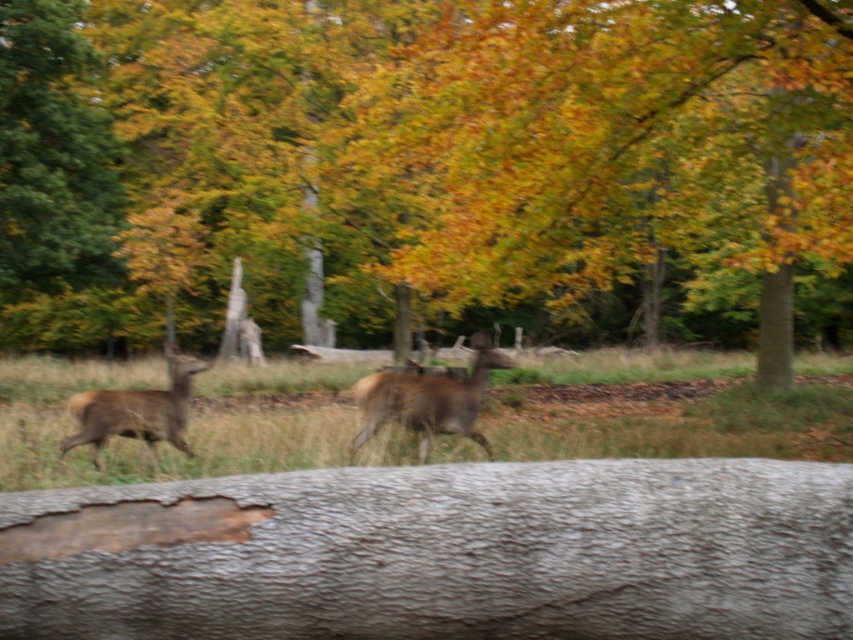
The height and width of the screenshot is (640, 853). What do you see at coordinates (427, 401) in the screenshot?
I see `brown matte/deer at center` at bounding box center [427, 401].

Does brown matte/deer at center appear on the right side of brown fur deer at left?

Indeed, brown matte/deer at center is positioned on the right side of brown fur deer at left.

Does point (392, 388) come behind point (169, 433)?

No, (392, 388) is in front of (169, 433).

At what (x,y) coordinates should I click in order to perform the action: click on brown matte/deer at center. Please return your answer as a coordinate pair (x, y). This screenshot has height=640, width=853. Looking at the image, I should click on (427, 401).

Does brown textured log at center have a larger size compared to smooth gray log at center?

Correct, brown textured log at center is larger in size than smooth gray log at center.

This screenshot has height=640, width=853. What do you see at coordinates (426, 172) in the screenshot? I see `brown textured log at center` at bounding box center [426, 172].

Is point (717, 77) behind point (538, 614)?

Yes.

Identify the location of brown textured log at center. The width and height of the screenshot is (853, 640). (426, 172).

This screenshot has height=640, width=853. In order to click on brown textured log at center in this screenshot , I will do `click(426, 172)`.

Can you confirm if brown textured log at center is thinner than brown fur deer at left?

No.

Identify the location of brown textured log at center. This screenshot has height=640, width=853. (426, 172).